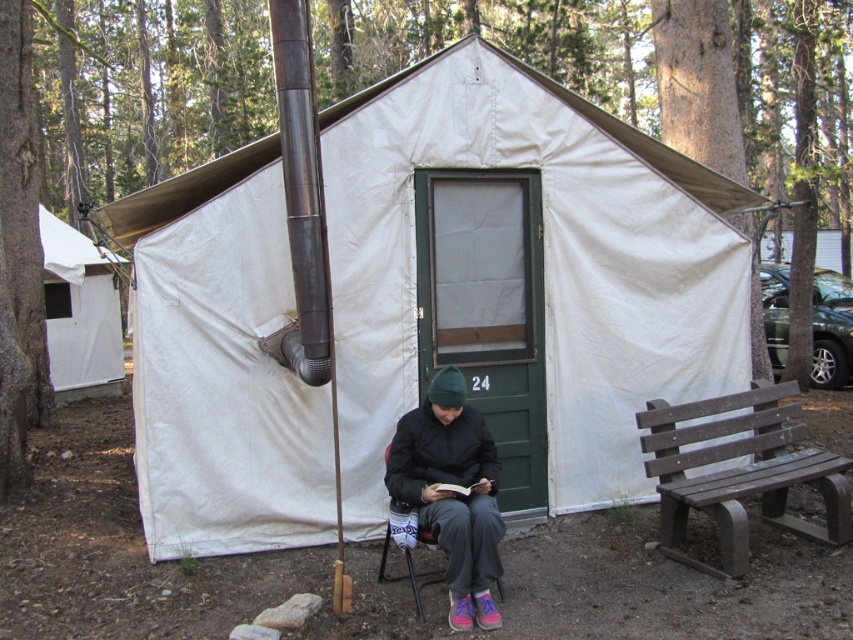
Question: Which point is farther from the camera taking this photo?

Choices:
 (A) (618, 344)
 (B) (384, 540)
 (C) (695, 440)

Answer: (A)

Question: Does white canvas tent at center have a larger size compared to brown plastic bench at right?

Choices:
 (A) no
 (B) yes

Answer: (B)

Question: Where is white canvas tent at center located in relation to metallic gray chair at center in the image?

Choices:
 (A) right
 (B) left

Answer: (A)

Question: Which object is positioned farthest from the brown plastic bench at right?

Choices:
 (A) metallic gray chair at center
 (B) white canvas tent at center

Answer: (A)

Question: Which of the following is the farthest from the observer?

Choices:
 (A) (416, 580)
 (B) (509, 96)
 (C) (728, 458)

Answer: (B)

Question: In this image, where is brown plastic bench at right located relative to metallic gray chair at center?

Choices:
 (A) right
 (B) left

Answer: (A)